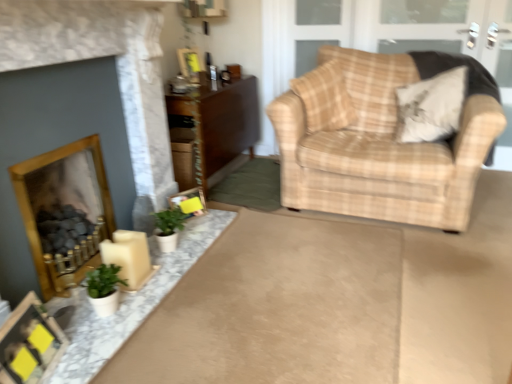
The image size is (512, 384). In order to click on free spot to the right of matte yellow picture frame at lower center, the first picture frame when ordered from right to left in this screenshot , I will do `click(210, 216)`.